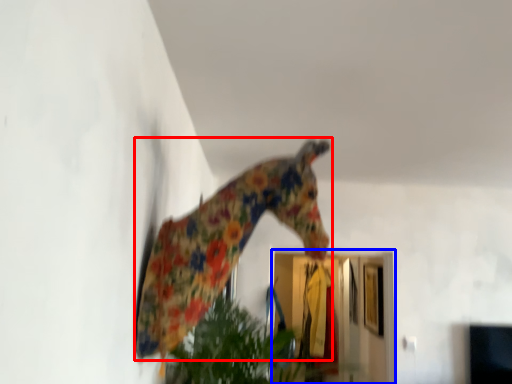
Question: Which object appears closest to the camera in this image, giraffe (highlighted by a red box) or glass door (highlighted by a blue box)?

Choices:
 (A) giraffe
 (B) glass door

Answer: (A)